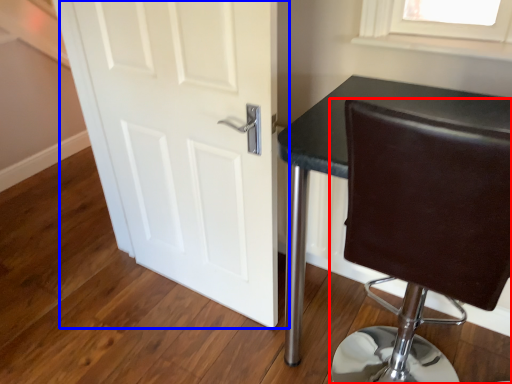
Question: Which of the following is the closest to the observer, chair (highlighted by a red box) or door (highlighted by a blue box)?

Choices:
 (A) chair
 (B) door

Answer: (A)